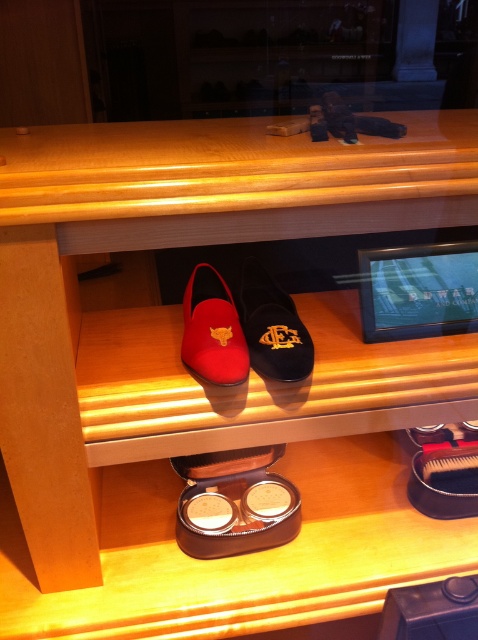
Who is positioned more to the right, velvet/black shoe at center or matte red leather shoe at center?

From the viewer's perspective, velvet/black shoe at center appears more on the right side.

Can you confirm if velvet/black shoe at center is wider than matte red leather shoe at center?

Indeed, velvet/black shoe at center has a greater width compared to matte red leather shoe at center.

Is point (308, 364) farther from camera compared to point (228, 381)?

Yes, it is.

Where is `velvet/black shoe at center`? This screenshot has height=640, width=478. velvet/black shoe at center is located at coordinates [271, 326].